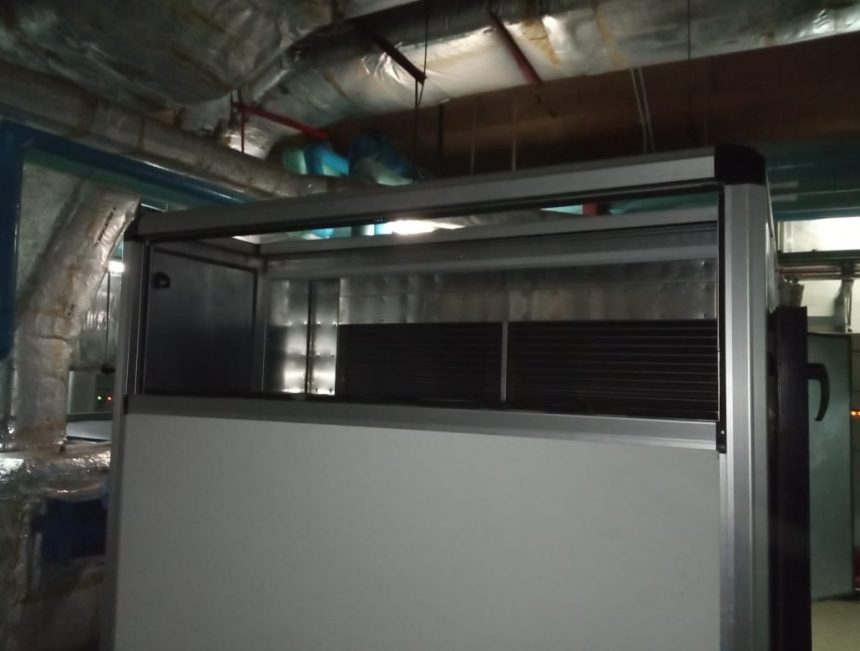
This screenshot has width=860, height=651. What are the coordinates of `floor` in the screenshot? It's located at (843, 633).